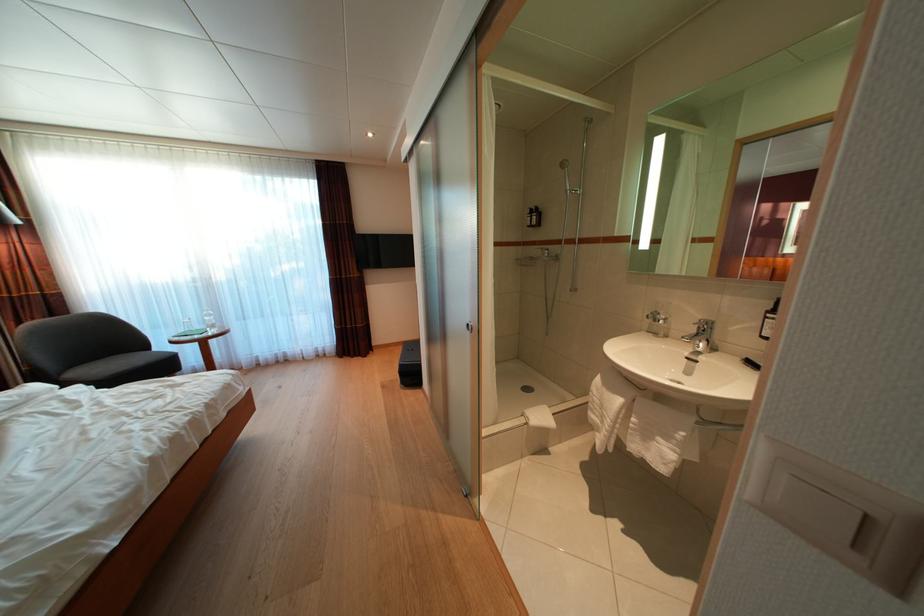
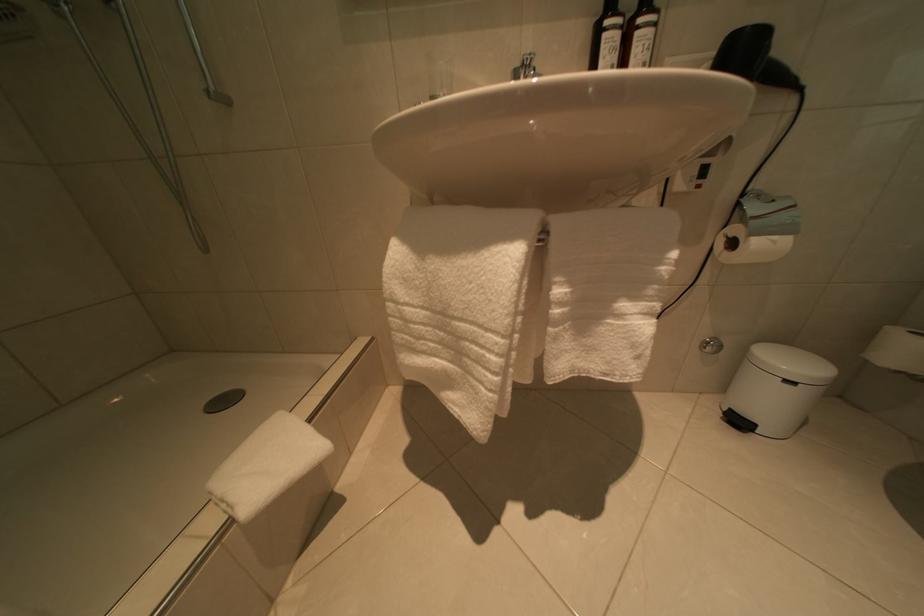
Locate, in the second image, the point that corresponds to pixel 627 407 in the first image.

(517, 262)